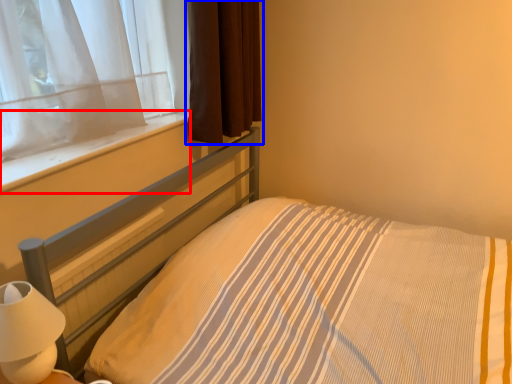
Question: Which of the following is the farthest to the observer, window sill (highlighted by a red box) or curtain (highlighted by a blue box)?

Choices:
 (A) window sill
 (B) curtain

Answer: (B)